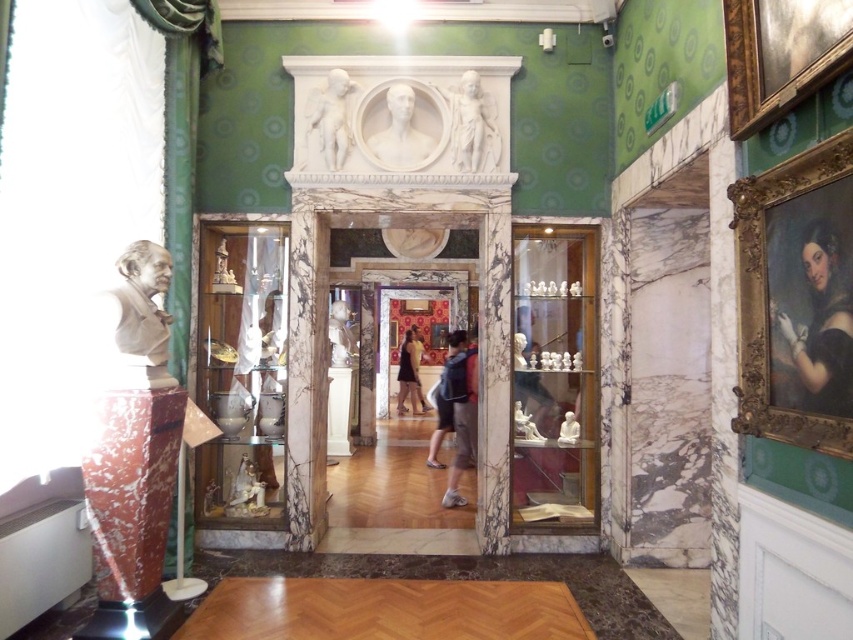
Between denim shorts at center and white marble cherub at upper center, which one has more height?

denim shorts at center

Is denim shorts at center above white marble cherub at upper center?

No.

Which is in front, point (465, 417) or point (337, 141)?

Point (337, 141)

At what (x,y) coordinates should I click in order to perform the action: click on denim shorts at center. Please return your answer as a coordinate pair (x, y). Looking at the image, I should click on pyautogui.click(x=461, y=416).

Is point (793, 84) in front of point (448, 412)?

Yes.

From the picture: Between gold-framed painting at upper right and dark blue jeans at center, which one has more height?

dark blue jeans at center is taller.

What do you see at coordinates (780, 54) in the screenshot? The width and height of the screenshot is (853, 640). I see `gold-framed painting at upper right` at bounding box center [780, 54].

Locate an element on the screen. The width and height of the screenshot is (853, 640). gold-framed painting at upper right is located at coordinates (780, 54).

Who is positioned more to the right, smooth black portrait at right or white marble statue at center?

smooth black portrait at right

Between smooth black portrait at right and white marble statue at center, which one is positioned lower?

white marble statue at center is below.

Does point (843, 301) come behind point (354, 340)?

No.

Locate an element on the screen. The width and height of the screenshot is (853, 640). smooth black portrait at right is located at coordinates (817, 324).